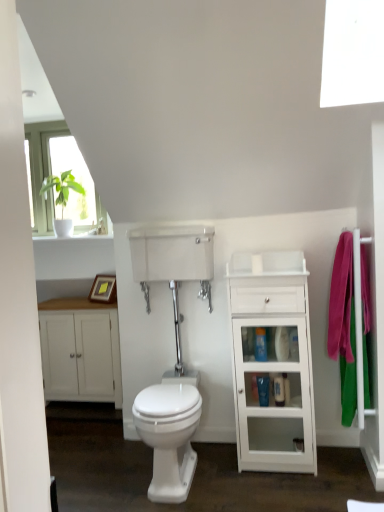
Where is `free space in front of white glossy cabinet at right`? free space in front of white glossy cabinet at right is located at coordinates (274, 490).